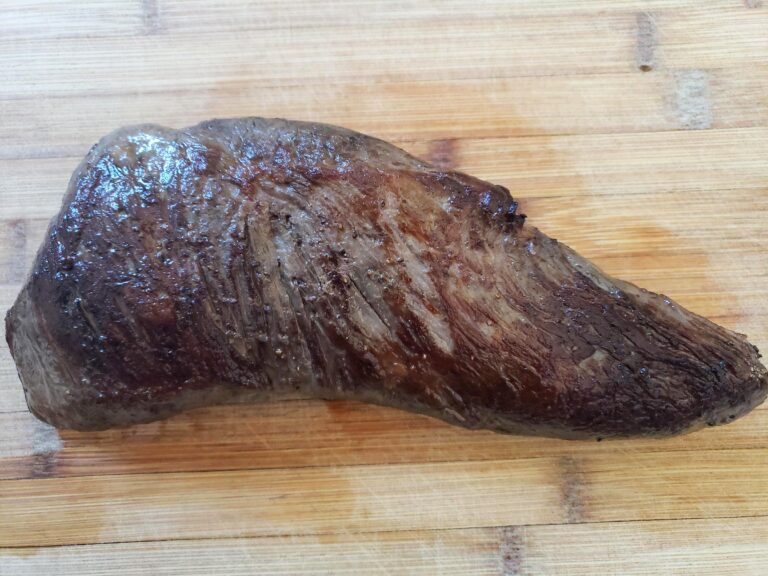
Identify the location of bleached wood finish. (660, 107).